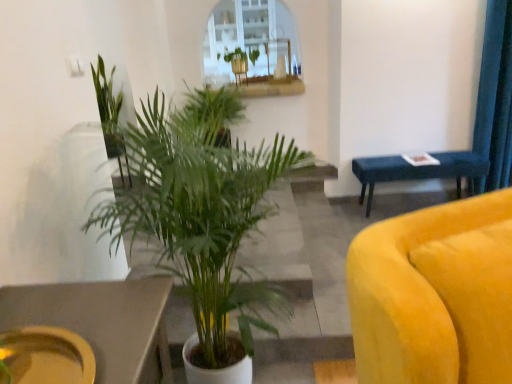
Question: Considering the relative positions of green leafy plant at center, which is the 3th houseplant from back to front, and green leafy plant at center, positioned as the fourth houseplant in back-to-front order, in the image provided, is green leafy plant at center, which is the 3th houseplant from back to front, to the right of green leafy plant at center, positioned as the fourth houseplant in back-to-front order, from the viewer's perspective?

Choices:
 (A) yes
 (B) no

Answer: (B)

Question: Does green leafy plant at center, which appears as the 2th houseplant when viewed from the front, turn towards green leafy plant at center, positioned as the fourth houseplant in back-to-front order?

Choices:
 (A) yes
 (B) no

Answer: (A)

Question: Considering the relative sizes of green leafy plant at center, which appears as the 2th houseplant when viewed from the front, and green leafy plant at center, which is the first houseplant in front-to-back order, in the image provided, is green leafy plant at center, which appears as the 2th houseplant when viewed from the front, smaller than green leafy plant at center, which is the first houseplant in front-to-back order,?

Choices:
 (A) no
 (B) yes

Answer: (B)

Question: From a real-world perspective, is green leafy plant at center, which appears as the 2th houseplant when viewed from the front, below green leafy plant at center, positioned as the fourth houseplant in back-to-front order?

Choices:
 (A) yes
 (B) no

Answer: (B)

Question: Is green leafy plant at center, which appears as the 2th houseplant when viewed from the front, positioned beyond the bounds of green leafy plant at center, positioned as the fourth houseplant in back-to-front order?

Choices:
 (A) no
 (B) yes

Answer: (B)

Question: Is point (193, 215) closer or farther from the camera than point (0, 352)?

Choices:
 (A) closer
 (B) farther

Answer: (B)

Question: Looking at their shapes, would you say green leafy plant at center, positioned as the fourth houseplant in back-to-front order, is wider or thinner than matte yellow platter at lower left?

Choices:
 (A) thin
 (B) wide

Answer: (B)

Question: From a real-world perspective, is green leafy plant at center, positioned as the fourth houseplant in back-to-front order, positioned above or below matte yellow platter at lower left?

Choices:
 (A) below
 (B) above

Answer: (A)

Question: Is green leafy plant at center, positioned as the fourth houseplant in back-to-front order, spatially inside matte yellow platter at lower left, or outside of it?

Choices:
 (A) inside
 (B) outside

Answer: (B)

Question: In terms of width, does green leafy plant at upper center, which ranks as the 1th houseplant in back-to-front order, look wider or thinner when compared to matte yellow platter at lower left?

Choices:
 (A) thin
 (B) wide

Answer: (A)

Question: Is green leafy plant at upper center, which appears as the fourth houseplant when viewed from the front, taller or shorter than matte yellow platter at lower left?

Choices:
 (A) tall
 (B) short

Answer: (A)

Question: From the image's perspective, relative to matte yellow platter at lower left, is green leafy plant at upper center, which appears as the fourth houseplant when viewed from the front, above or below?

Choices:
 (A) above
 (B) below

Answer: (A)

Question: Relative to matte yellow platter at lower left, is green leafy plant at upper center, which ranks as the 1th houseplant in back-to-front order, in front or behind?

Choices:
 (A) front
 (B) behind

Answer: (B)

Question: In terms of height, does green leafy plant at center, which appears as the 2th houseplant when viewed from the front, look taller or shorter compared to blue fabric bench at right?

Choices:
 (A) short
 (B) tall

Answer: (B)

Question: Relative to blue fabric bench at right, is green leafy plant at center, which is the 3th houseplant from back to front, in front or behind?

Choices:
 (A) front
 (B) behind

Answer: (A)